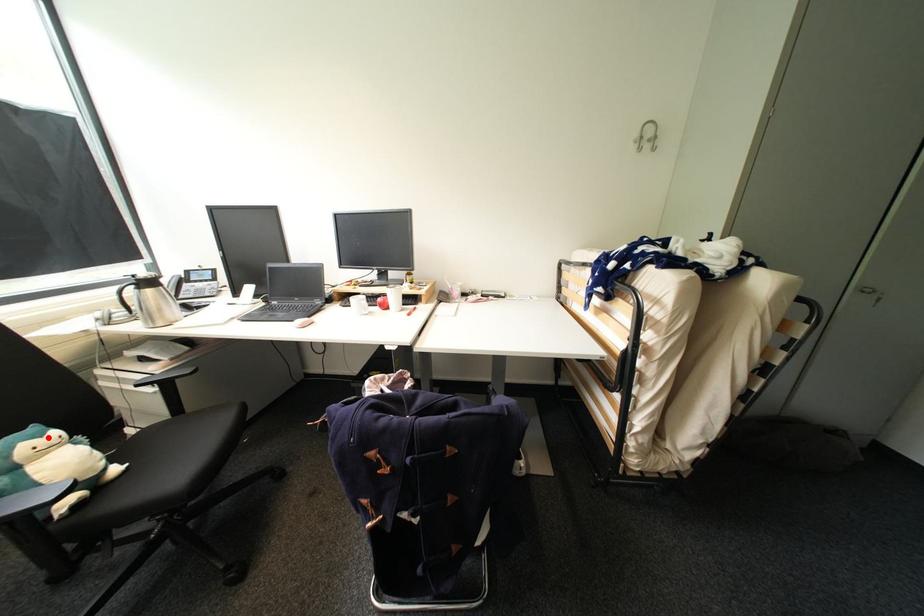
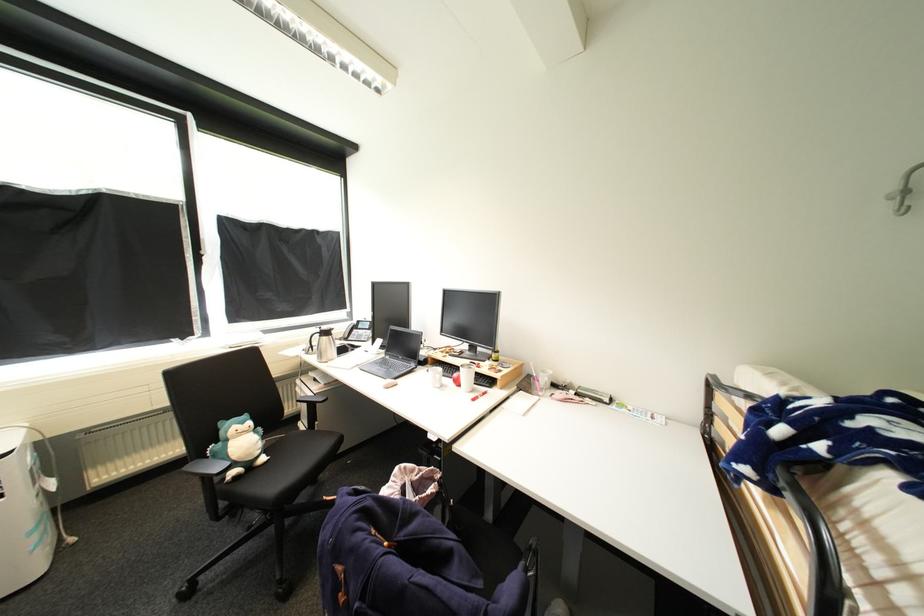
In the second image, find the point that corresponds to the highlighted location in the first image.

(249, 424)